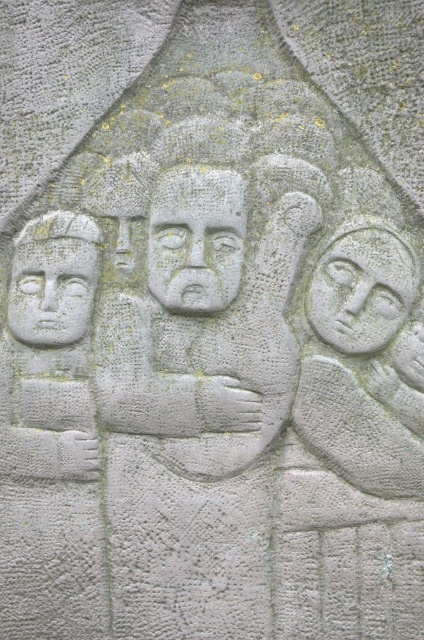
The image size is (424, 640). Describe the element at coordinates (195, 240) in the screenshot. I see `carved stone face at center` at that location.

Is carved stone face at center in front of gray stone face at left?

Yes, it is in front of gray stone face at left.

Between point (175, 262) and point (64, 244), which one is positioned in front?

Point (175, 262)

Find the location of `carved stone face at center`. carved stone face at center is located at coordinates tap(195, 240).

Is carved stone face at center positioned at the back of gray stone face at right?

Yes, it is.

What are the coordinates of `carved stone face at center` in the screenshot? It's located at (195, 240).

You are a GUI agent. You are given a task and a screenshot of the screen. Output one action in this format:
    pyautogui.click(x=<x>, y=<y>)
    Task: Click on the gray stone face at right
    The image size is (424, 640).
    Given the screenshot: What is the action you would take?
    pyautogui.click(x=362, y=291)

Is gray stone face at right above gray stone face at left?

Indeed, gray stone face at right is positioned over gray stone face at left.

In order to click on gray stone face at right in this screenshot , I will do `click(362, 291)`.